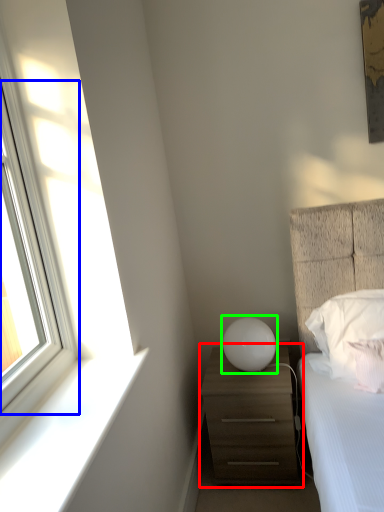
Question: Which object is positioned farthest from chest of drawers (highlighted by a red box)? Select from window (highlighted by a blue box) and table lamp (highlighted by a green box).

Choices:
 (A) window
 (B) table lamp

Answer: (A)